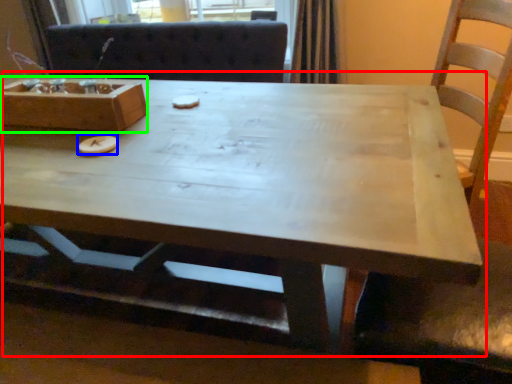
Question: Which is farther away from coffee table (highlighted by a red box)? food (highlighted by a blue box) or box (highlighted by a green box)?

Choices:
 (A) food
 (B) box

Answer: (A)